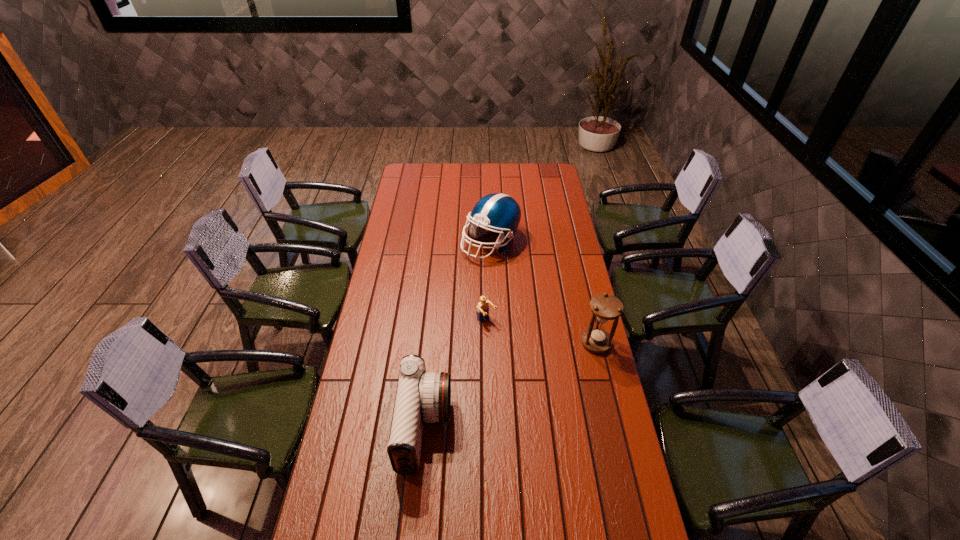
Where is `vacant space at the far right corner`? vacant space at the far right corner is located at coordinates (541, 173).

I want to click on blank region between the camcorder and the football helmet, so click(458, 335).

At what (x,y) coordinates should I click in order to perform the action: click on unoccupied area between the Lego and the farthest object. Please return your answer as a coordinate pair (x, y). The image size is (960, 540). Looking at the image, I should click on tap(489, 282).

Image resolution: width=960 pixels, height=540 pixels. I want to click on vacant space in between the nearest object and the shortest object, so click(x=456, y=375).

Find the location of `vacant region between the nearest object and the second nearest object`. vacant region between the nearest object and the second nearest object is located at coordinates (511, 386).

Identify the location of unoccupied area between the second farthest object and the camcorder. (456, 375).

Locate an element on the screen. This screenshot has width=960, height=540. vacant region between the farthest object and the shortest object is located at coordinates (489, 282).

At what (x,y) coordinates should I click in order to perform the action: click on vacant region between the Lego and the hourglass. Please return your answer as a coordinate pair (x, y). Looking at the image, I should click on (541, 332).

The height and width of the screenshot is (540, 960). Find the location of `empty space that is in between the farthest object and the nearest object`. empty space that is in between the farthest object and the nearest object is located at coordinates (458, 335).

Image resolution: width=960 pixels, height=540 pixels. I want to click on free point between the Lego and the leftmost object, so click(x=456, y=375).